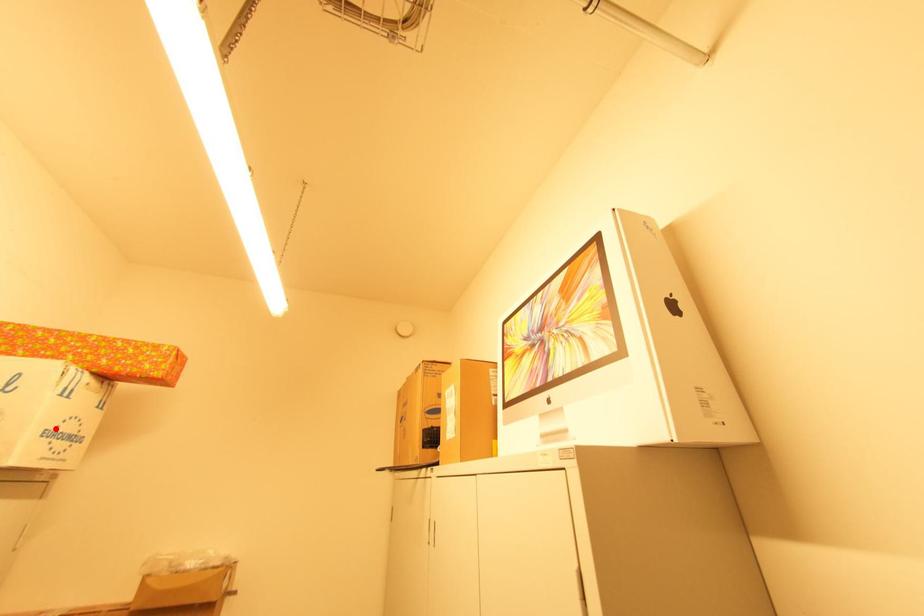
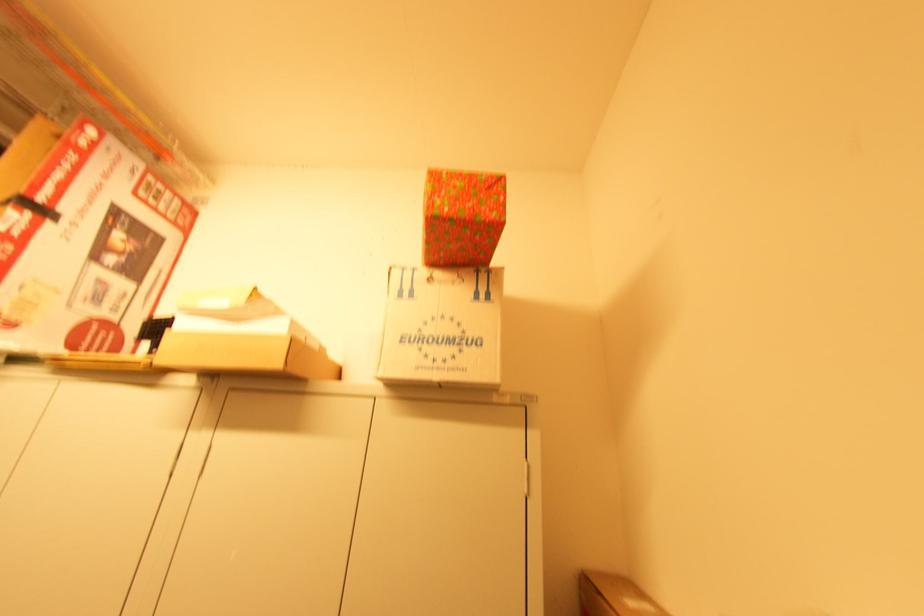
Locate, in the second image, the point that corresponds to the highlighted location in the first image.

(418, 333)